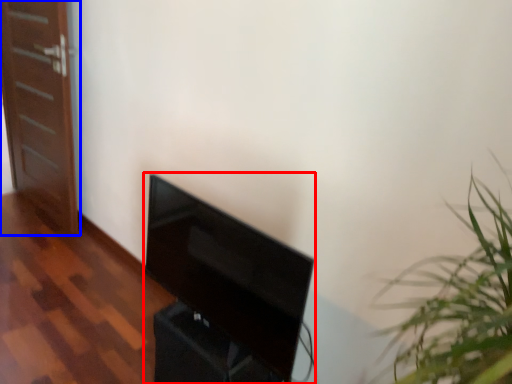
Question: Which object appears farthest to the camera in this image, furniture (highlighted by a red box) or door (highlighted by a blue box)?

Choices:
 (A) furniture
 (B) door

Answer: (B)